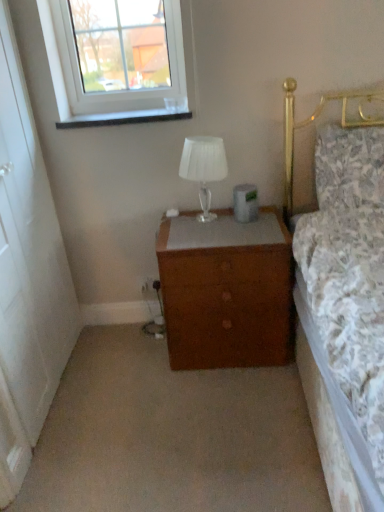
Where is `vacant area situated below translucent glass lamp at center (from a real-world perspective)`? The image size is (384, 512). vacant area situated below translucent glass lamp at center (from a real-world perspective) is located at coordinates (200, 214).